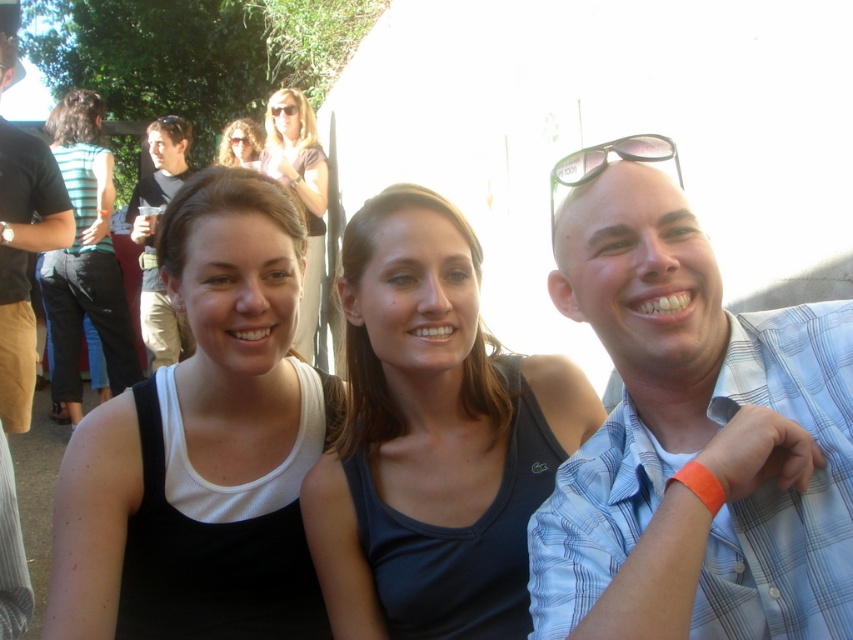
Question: Which point is closer to the camera?

Choices:
 (A) (320, 200)
 (B) (390, 451)
 (C) (254, 228)
 (D) (172, 172)

Answer: (B)

Question: Which object is the farthest from the black tank top at left?

Choices:
 (A) black plastic goggles at upper center
 (B) sunglasses at center

Answer: (B)

Question: Is black tank top at center smaller than black cotton t-shirt at left?

Choices:
 (A) yes
 (B) no

Answer: (B)

Question: Which of the following is the farthest from the observer?

Choices:
 (A) (86, 104)
 (B) (703, 477)

Answer: (A)

Question: Is black cotton t-shirt at left in front of orange fabric wristband at right?

Choices:
 (A) yes
 (B) no

Answer: (B)

Question: Does black cotton t-shirt at left have a lesser width compared to orange fabric wristband at right?

Choices:
 (A) no
 (B) yes

Answer: (A)